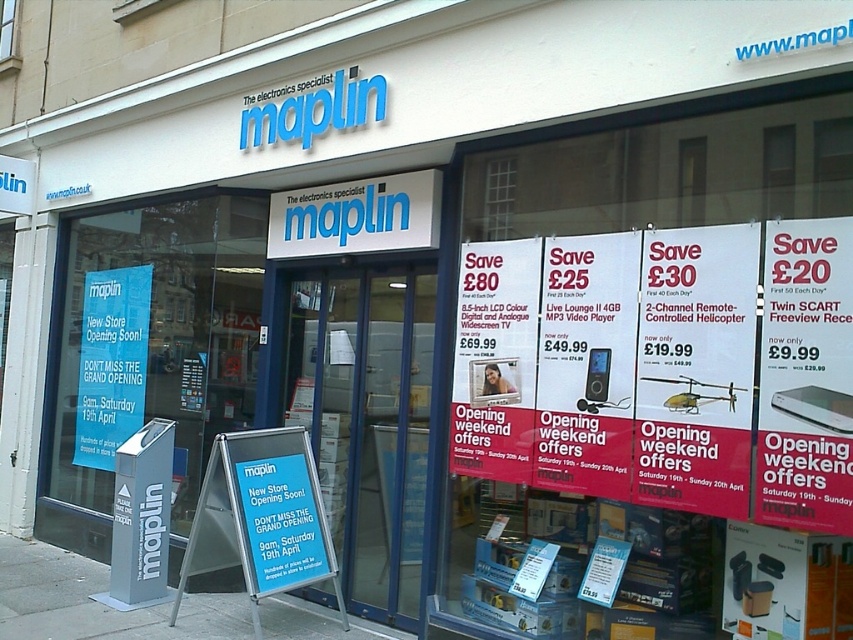
What is the color of the poster at the point with coordinates (805, 378)?

The point at coordinates (805, 378) is on a matte white poster at right.

In the scene shown: You are standing at the entrance of the Maplin electronics store. You want to read the matte white poster at right but you are nearsighted. If you move forward 1 meter towards the poster, will it appear larger?

The matte white poster at right is currently 3.25 meters away. Moving forward 1 meter would reduce the distance to 2.25 meters, making the poster appear larger.